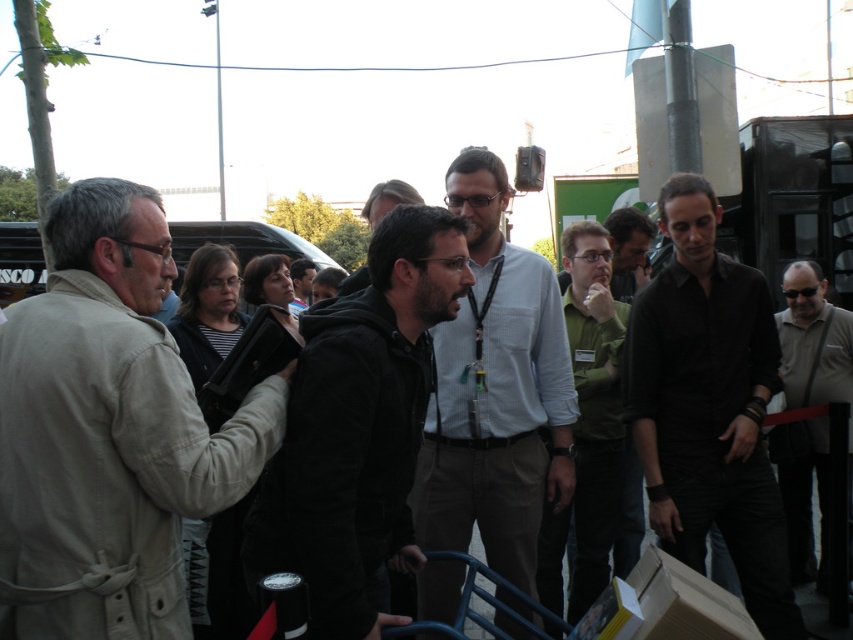
Question: Can you confirm if beige fabric trench coat at left is positioned below matte black shirt at center?

Choices:
 (A) no
 (B) yes

Answer: (A)

Question: Among these objects, which one is nearest to the camera?

Choices:
 (A) beige fabric trench coat at left
 (B) black matte jacket at center
 (C) matte black shirt at center
 (D) light blue shirt at center

Answer: (A)

Question: Which point is farther to the camera?

Choices:
 (A) beige fabric trench coat at left
 (B) black matte jacket at center
 (C) gray fabric shirt at center
 (D) matte black shirt at center

Answer: (C)

Question: Which point is farther to the camera?

Choices:
 (A) gray fabric shirt at center
 (B) light blue shirt at center

Answer: (A)

Question: Is black matte jacket at center above light blue shirt at center?

Choices:
 (A) yes
 (B) no

Answer: (B)

Question: Is black matte jacket at center further to camera compared to light blue shirt at center?

Choices:
 (A) yes
 (B) no

Answer: (B)